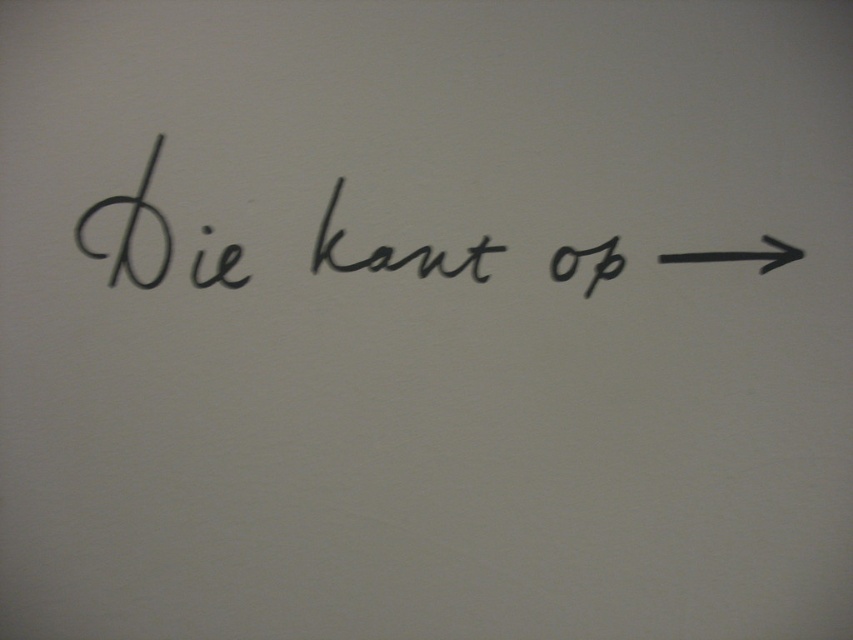
Question: Where is black handwritten text at center located in relation to black rubber arrow at right in the image?

Choices:
 (A) left
 (B) right

Answer: (A)

Question: Which point is closer to the camera?

Choices:
 (A) (679, 252)
 (B) (332, 196)

Answer: (B)

Question: Is the position of black handwritten text at center less distant than that of black rubber arrow at right?

Choices:
 (A) no
 (B) yes

Answer: (B)

Question: Does black handwritten text at center have a smaller size compared to black rubber arrow at right?

Choices:
 (A) yes
 (B) no

Answer: (B)

Question: Which point is closer to the camera taking this photo?

Choices:
 (A) (321, 224)
 (B) (772, 266)

Answer: (A)